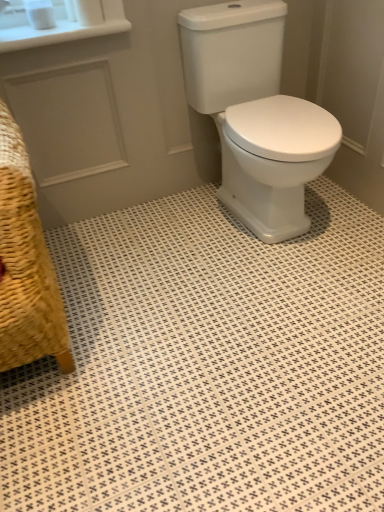
Question: Is white glossy ceramic tile at center shorter than woven straw armchair at lower left?

Choices:
 (A) no
 (B) yes

Answer: (B)

Question: Is white glossy ceramic tile at center with woven straw armchair at lower left?

Choices:
 (A) yes
 (B) no

Answer: (B)

Question: Does white glossy ceramic tile at center have a greater width compared to woven straw armchair at lower left?

Choices:
 (A) yes
 (B) no

Answer: (A)

Question: From the image's perspective, is white glossy ceramic tile at center beneath woven straw armchair at lower left?

Choices:
 (A) no
 (B) yes

Answer: (B)

Question: Does white glossy ceramic tile at center lie in front of woven straw armchair at lower left?

Choices:
 (A) yes
 (B) no

Answer: (B)

Question: Would you say woven straw armchair at lower left is part of white glossy ceramic tile at center's contents?

Choices:
 (A) yes
 (B) no

Answer: (B)

Question: Is white matte toilet paper at upper left, which is the first toilet paper in left-to-right order, not within white glossy ceramic tile at center?

Choices:
 (A) yes
 (B) no

Answer: (A)

Question: From a real-world perspective, is white matte toilet paper at upper left, the 2th toilet paper from the right, beneath white glossy ceramic tile at center?

Choices:
 (A) yes
 (B) no

Answer: (B)

Question: Does white matte toilet paper at upper left, which is the first toilet paper in left-to-right order, have a greater width compared to white glossy ceramic tile at center?

Choices:
 (A) no
 (B) yes

Answer: (A)

Question: Is white matte toilet paper at upper left, the 2th toilet paper from the right, next to white glossy ceramic tile at center and touching it?

Choices:
 (A) yes
 (B) no

Answer: (B)

Question: Is white matte toilet paper at upper left, which is the first toilet paper in left-to-right order, not near white glossy ceramic tile at center?

Choices:
 (A) yes
 (B) no

Answer: (A)

Question: Is white matte toilet paper at upper left, the 2th toilet paper from the right, oriented towards white glossy ceramic tile at center?

Choices:
 (A) yes
 (B) no

Answer: (B)

Question: Would you say white glossy porcelain at center is part of white matte toilet paper at upper left, which is the 2th toilet paper in left-to-right order,'s contents?

Choices:
 (A) no
 (B) yes

Answer: (A)